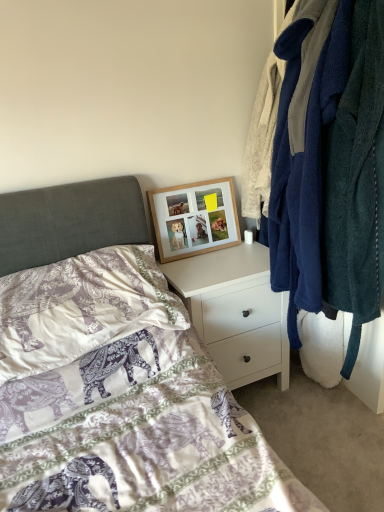
Question: From a real-world perspective, is soft fleece robes at right above or below woodenobject at upper center?

Choices:
 (A) above
 (B) below

Answer: (A)

Question: Considering their positions, is soft fleece robes at right located in front of or behind woodenobject at upper center?

Choices:
 (A) behind
 (B) front

Answer: (B)

Question: Which of these objects is positioned farthest from the woodenobject at upper center?

Choices:
 (A) soft fleece robes at right
 (B) white matte nightstand at upper center
 (C) purple elephant-patterned pillow at lower left

Answer: (C)

Question: Which is nearer to the white matte nightstand at upper center?

Choices:
 (A) purple elephant-patterned pillow at lower left
 (B) woodenobject at upper center
 (C) soft fleece robes at right

Answer: (B)